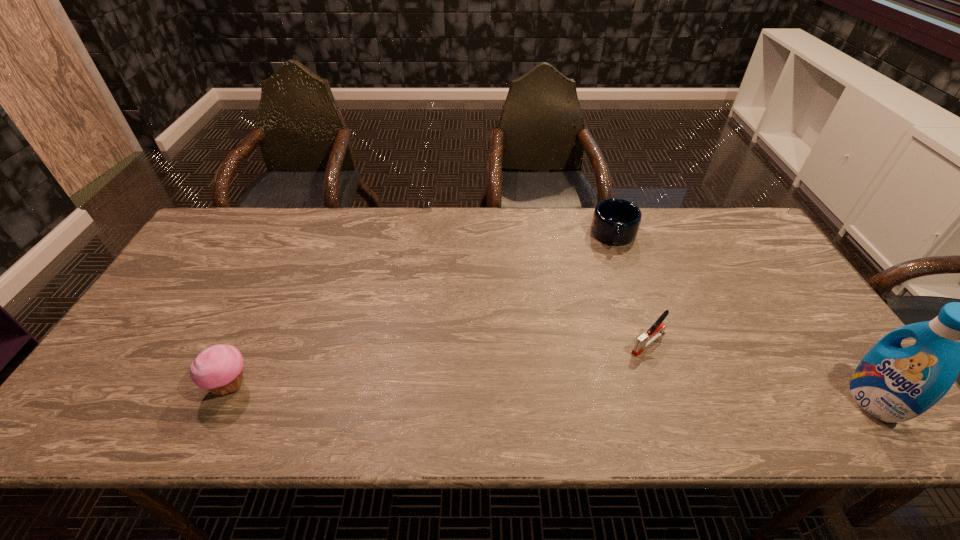
Locate an element on the screen. This screenshot has width=960, height=540. empty space that is in between the second farthest object and the cupcake is located at coordinates (440, 364).

This screenshot has height=540, width=960. In order to click on free space between the third nearest object and the third shortest object in this screenshot , I will do `click(440, 364)`.

Where is `free area in between the farthest object and the leftmost object`? The height and width of the screenshot is (540, 960). free area in between the farthest object and the leftmost object is located at coordinates (422, 310).

Choose which object is the third nearest neighbor to the farthest object. Please provide its 2D coordinates. Your answer should be formatted as a tuple, i.e. [(x, y)], where the tuple contains the x and y coordinates of a point satisfying the conditions above.

[(218, 368)]

Find the location of a particular element. object that ranks as the second closest to the farthest object is located at coordinates (894, 384).

Identify the location of vacant area that satisfies the following two spatial constraints: 1. on the front side of the leftmost object; 2. on the front-facing side of the rightmost object. (224, 400).

Where is `vacant space that satisfies the following two spatial constraints: 1. on the front side of the mug; 2. on the front-facing side of the tallest object`? vacant space that satisfies the following two spatial constraints: 1. on the front side of the mug; 2. on the front-facing side of the tallest object is located at coordinates (671, 400).

At what (x,y) coordinates should I click in order to perform the action: click on free space that satisfies the following two spatial constraints: 1. on the front side of the tallest object; 2. on the front-facing side of the mug. Please return your answer as a coordinate pair (x, y). This screenshot has width=960, height=540. Looking at the image, I should click on (671, 400).

Locate an element on the screen. The width and height of the screenshot is (960, 540). free space that satisfies the following two spatial constraints: 1. on the front side of the second tallest object; 2. on the front-facing side of the tallest object is located at coordinates (224, 400).